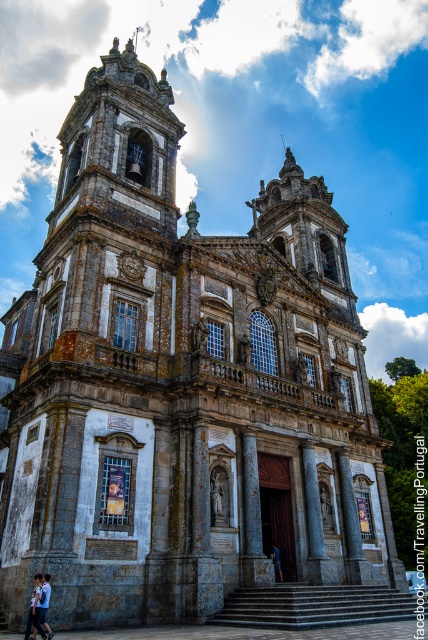
Question: Is light blue shirt at lower left to the right of dark blue fabric at lower center from the viewer's perspective?

Choices:
 (A) no
 (B) yes

Answer: (A)

Question: Which of the following is the farthest from the observer?

Choices:
 (A) (41, 600)
 (B) (276, 547)

Answer: (B)

Question: Which object appears closest to the camera in this image?

Choices:
 (A) light blue shirt at lower left
 (B) dark blue fabric at lower center

Answer: (A)

Question: Is light blue shirt at lower left bigger than dark blue fabric at lower center?

Choices:
 (A) no
 (B) yes

Answer: (B)

Question: Is light blue shirt at lower left thinner than dark blue fabric at lower center?

Choices:
 (A) yes
 (B) no

Answer: (B)